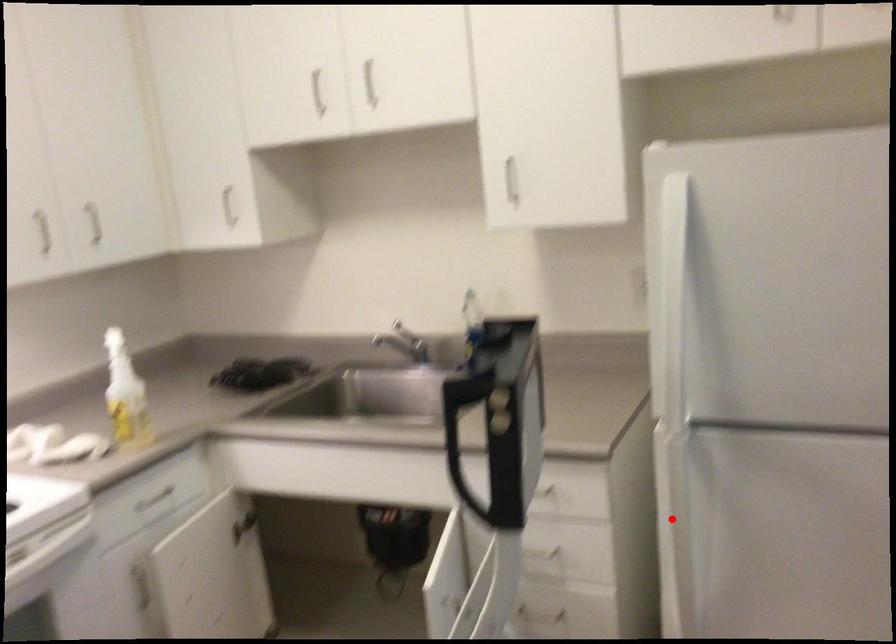
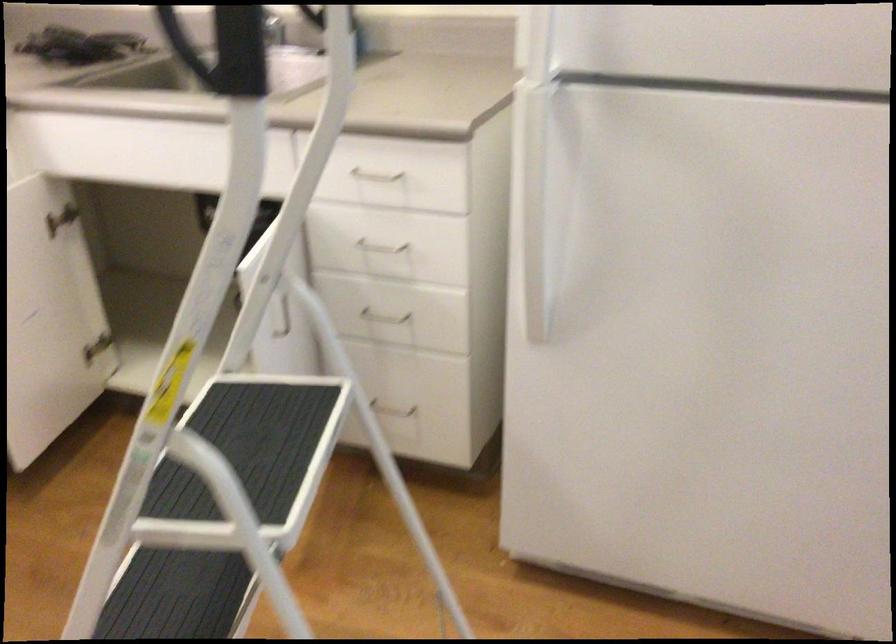
Locate, in the second image, the point that corresponds to the highlighted location in the first image.

(530, 203)